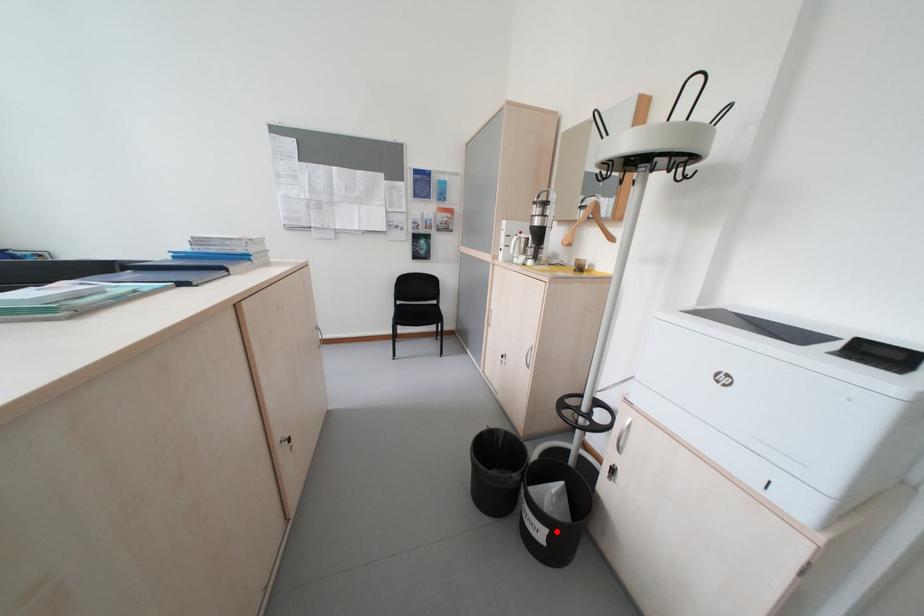
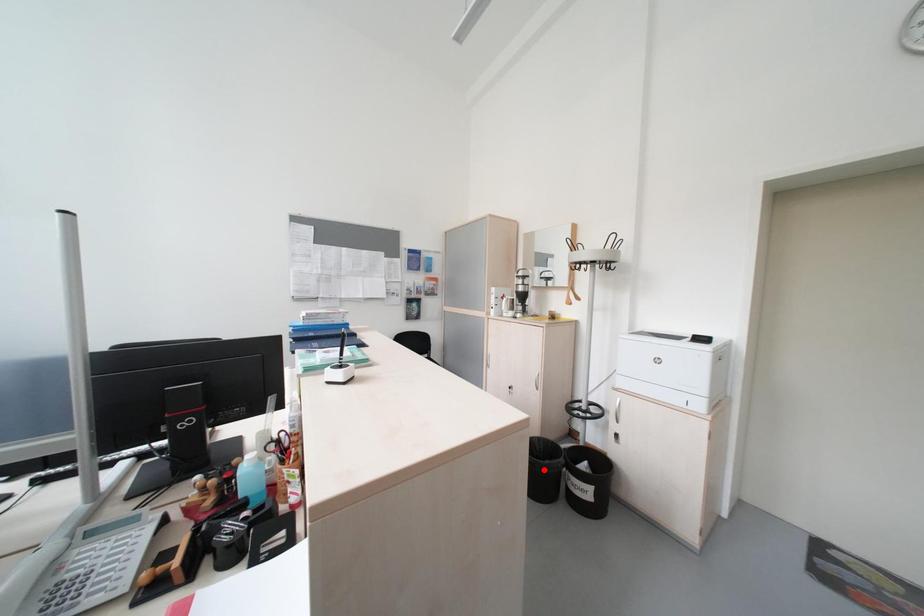
I am providing you with two images of the same scene from different viewpoints. A red point is marked on the first image and another point is marked on the second image. Is the red point in image1 aligned with the point shown in image2?

No